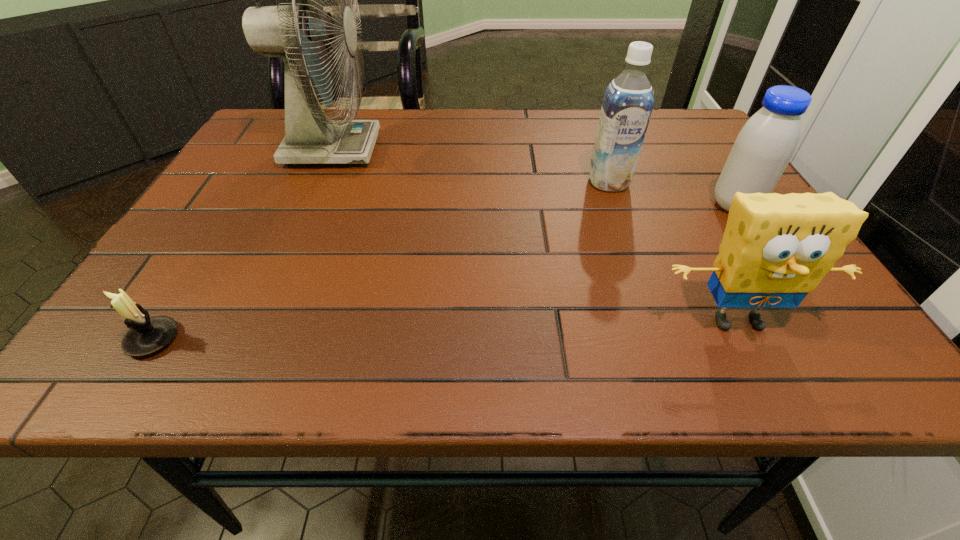
What are the coordinates of `fan` in the screenshot? It's located at (301, 35).

Image resolution: width=960 pixels, height=540 pixels. I want to click on the tallest object, so click(x=301, y=35).

Locate an element on the screen. The image size is (960, 540). the taller soya milk is located at coordinates (628, 101).

Identify the location of the left soya milk. (628, 101).

Locate an element on the screen. The image size is (960, 540). the shorter soya milk is located at coordinates (763, 148).

Image resolution: width=960 pixels, height=540 pixels. Identify the location of sponge. (776, 249).

Where is `the leftmost object`? the leftmost object is located at coordinates (147, 335).

Locate an element on the screen. The width and height of the screenshot is (960, 540). candle holder is located at coordinates (147, 335).

This screenshot has width=960, height=540. What are the coordinates of `free space located 0.380m on the front-facing side of the tallest object` in the screenshot? It's located at (530, 150).

I want to click on free space located on the label of the taller soya milk, so click(x=631, y=245).